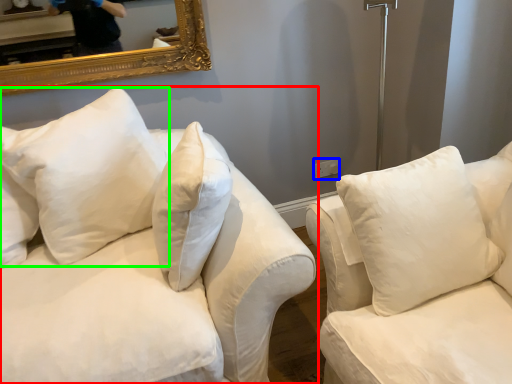
Question: Which is farther away from studio couch (highlighted by a red box)? electric outlet (highlighted by a blue box) or pillow (highlighted by a green box)?

Choices:
 (A) electric outlet
 (B) pillow

Answer: (A)